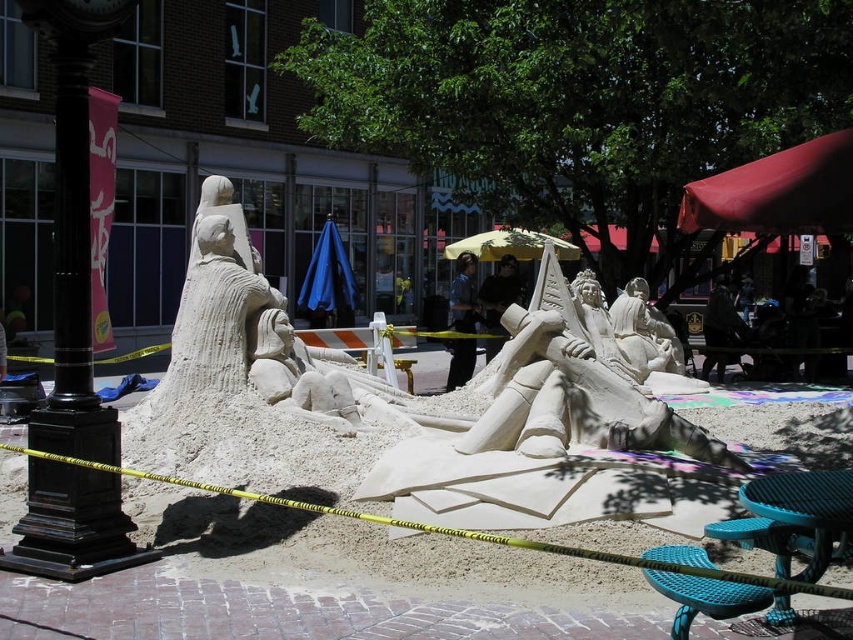
Question: Which object is farther from the camera taking this photo?

Choices:
 (A) dark blue jeans at center
 (B) yellow fabric umbrella at center
 (C) dark fabric bag at lower right
 (D) white sand sculpture at center

Answer: (B)

Question: Which is farther from the dark blue jeans at center?

Choices:
 (A) blue fabric umbrella at center
 (B) dark fabric bag at lower right

Answer: (A)

Question: Which object appears farthest from the camera in this image?

Choices:
 (A) dark blue jeans at center
 (B) denim pants at center
 (C) teal plastic stool at lower right
 (D) white sand sculpture at center

Answer: (B)

Question: Is blue fabric umbrella at center in front of dark blue jeans at center?

Choices:
 (A) yes
 (B) no

Answer: (B)

Question: Can you confirm if white sand sculpture at center is thinner than yellow fabric umbrella at center?

Choices:
 (A) yes
 (B) no

Answer: (B)

Question: Is white sand sculpture at center closer to camera compared to blue fabric umbrella at center?

Choices:
 (A) yes
 (B) no

Answer: (A)